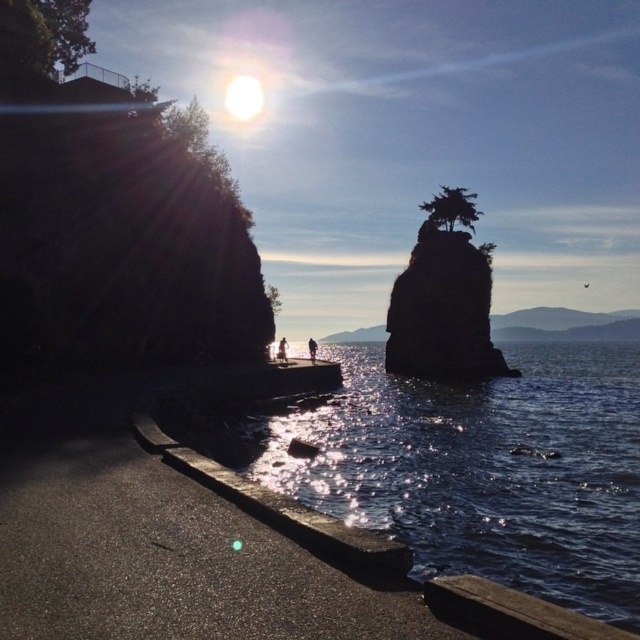
Does point (461, 499) come behind point (440, 202)?

No, (461, 499) is closer to viewer.

Can you confirm if glistening water at lower center is positioned to the left of green matte tree at upper center?

Incorrect, glistening water at lower center is not on the left side of green matte tree at upper center.

Measure the distance between point [564,600] and camera.

The distance of point [564,600] from camera is 12.68 meters.

In order to click on glistening water at lower center in this screenshot , I will do 483,468.

The image size is (640, 640). Find the location of `glistening water at lower center`. glistening water at lower center is located at coordinates pyautogui.click(x=483, y=468).

Who is more distant from viewer, (x=385, y=474) or (x=58, y=52)?

Positioned behind is point (x=58, y=52).

Between point (625, 550) and point (38, 67), which one is positioned behind?

Point (38, 67)

Identify the location of glistening water at lower center. This screenshot has height=640, width=640. (483, 468).

Is glistening water at lower center bigger than green leafy tree at center?

Incorrect, glistening water at lower center is not larger than green leafy tree at center.

Does point (332, 461) come farther from viewer compared to point (275, 292)?

No, (332, 461) is in front of (275, 292).

Is point (301, 353) positioned after point (275, 300)?

Yes.

Identify the location of glistening water at lower center. The height and width of the screenshot is (640, 640). (483, 468).